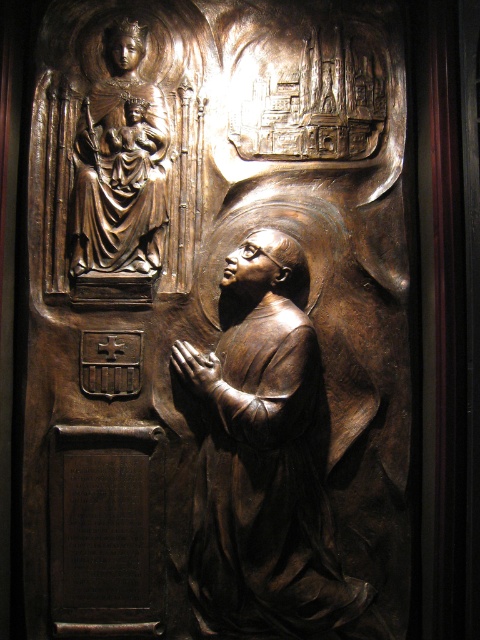
Can you confirm if bronze statue at center is bigger than bronze statue of madonna and child at upper left?

Indeed, bronze statue at center has a larger size compared to bronze statue of madonna and child at upper left.

Which is behind, point (237, 572) or point (151, 243)?

Point (151, 243)

What do you see at coordinates (264, 458) in the screenshot?
I see `bronze statue at center` at bounding box center [264, 458].

The image size is (480, 640). In order to click on bronze statue at center in this screenshot , I will do (264, 458).